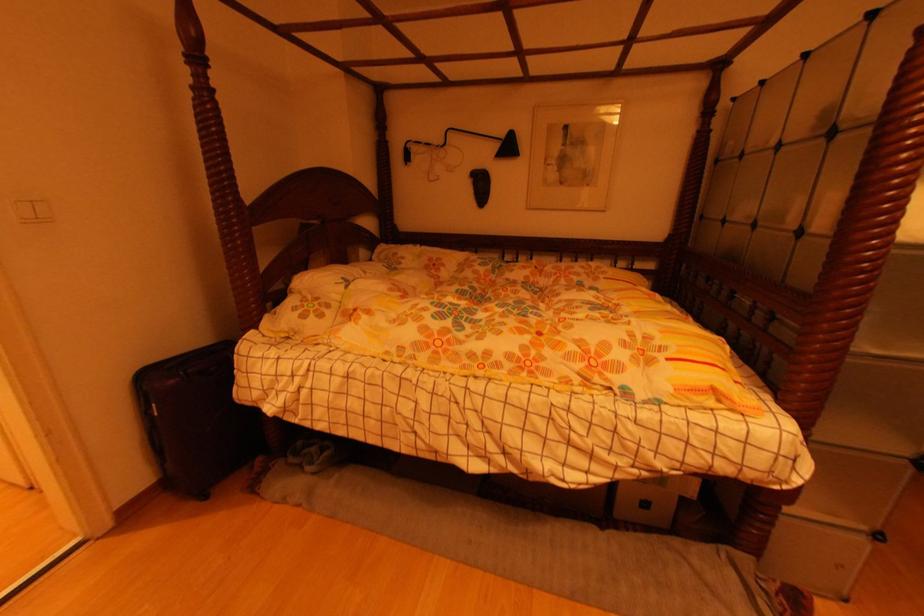
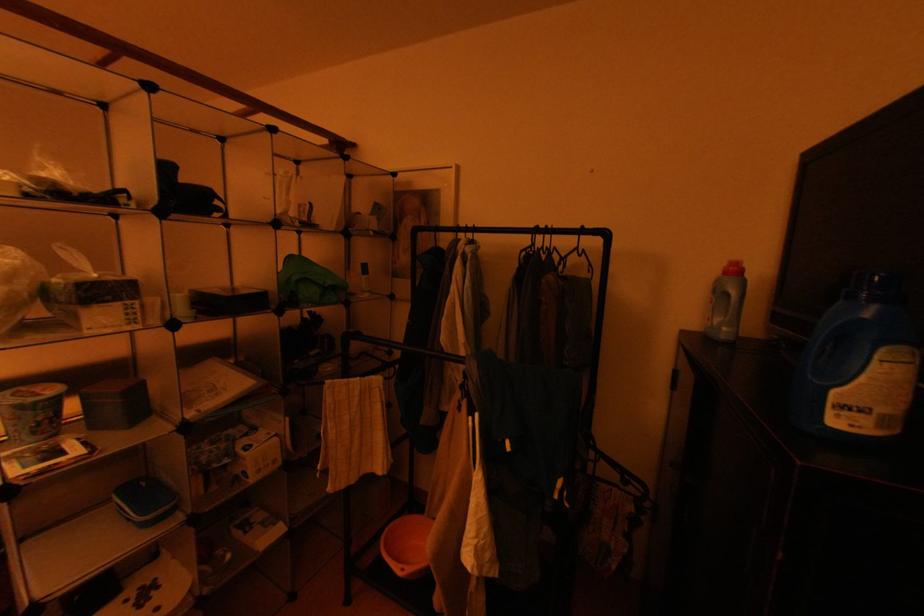
Question: Which direction would the cameraman need to move to produce the second image? Reply with the corresponding letter.

Choices:
 (A) Left
 (B) Right
 (C) Forward
 (D) Backward

Answer: (B)